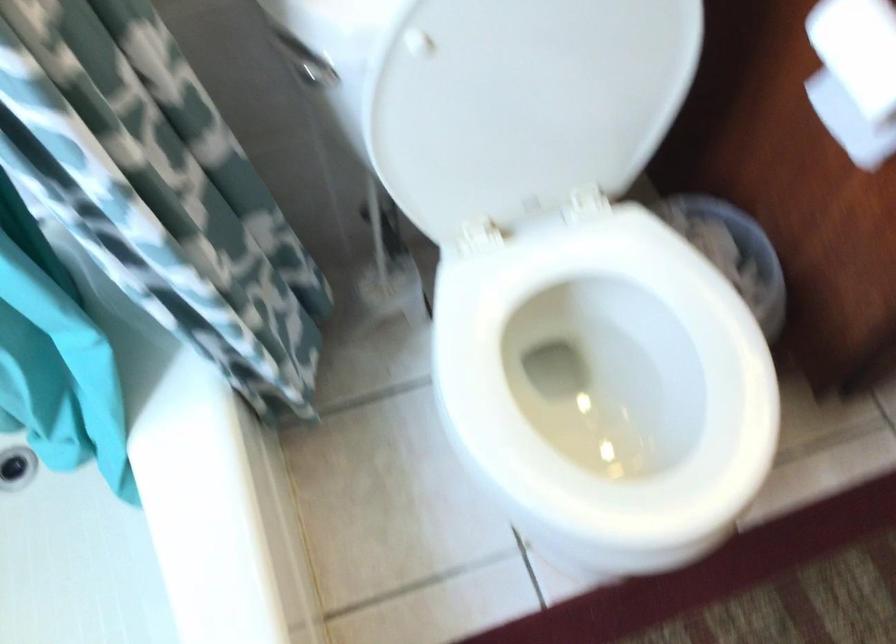
This screenshot has width=896, height=644. Find the location of `toilet flush handle`. toilet flush handle is located at coordinates (304, 64).